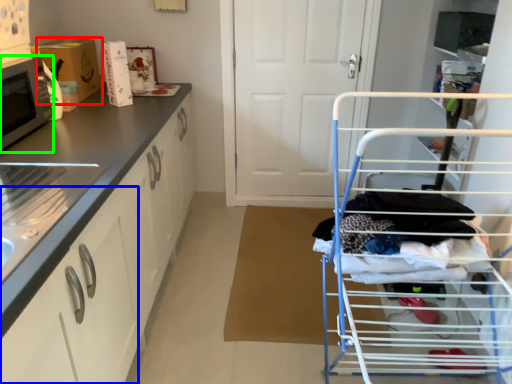
Question: Which object is the closest to the cardboard box (highlighted by a red box)? Choose among these: drawer (highlighted by a blue box) or microwave oven (highlighted by a green box).

Choices:
 (A) drawer
 (B) microwave oven

Answer: (B)